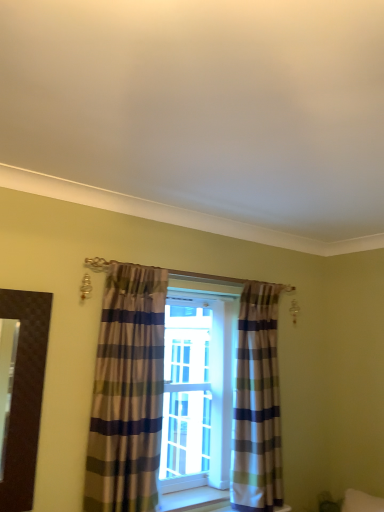
Describe the element at coordinates (257, 403) in the screenshot. I see `striped fabric curtain at center, the 1th curtain viewed from the right` at that location.

What are the coordinates of `striped fabric curtain at center, which appears as the second curtain when viewed from the left` in the screenshot? It's located at (257, 403).

The image size is (384, 512). What are the coordinates of `striped fabric curtain at center, the second curtain in the back-to-front sequence` in the screenshot? It's located at (127, 392).

The image size is (384, 512). Describe the element at coordinates (127, 392) in the screenshot. I see `striped fabric curtain at center, marked as the 2th curtain in a right-to-left arrangement` at that location.

I want to click on striped fabric curtain at center, the 2th curtain viewed from the front, so click(257, 403).

Can you confirm if striped fabric curtain at center, which appears as the second curtain when viewed from the left, is positioned to the left of striped fabric curtain at center, arranged as the first curtain when viewed from the left?

Incorrect, striped fabric curtain at center, which appears as the second curtain when viewed from the left, is not on the left side of striped fabric curtain at center, arranged as the first curtain when viewed from the left.

In the image, is striped fabric curtain at center, which appears as the second curtain when viewed from the left, positioned in front of or behind striped fabric curtain at center, the second curtain in the back-to-front sequence?

striped fabric curtain at center, which appears as the second curtain when viewed from the left, is behind striped fabric curtain at center, the second curtain in the back-to-front sequence.

Which is behind, point (260, 287) or point (157, 411)?

Point (260, 287)

From the image's perspective, is striped fabric curtain at center, which appears as the second curtain when viewed from the left, located beneath striped fabric curtain at center, marked as the 2th curtain in a right-to-left arrangement?

Indeed, from the image's perspective, striped fabric curtain at center, which appears as the second curtain when viewed from the left, is shown beneath striped fabric curtain at center, marked as the 2th curtain in a right-to-left arrangement.

From a real-world perspective, between striped fabric curtain at center, acting as the 1th curtain starting from the back, and striped fabric curtain at center, which is the 1th curtain from front to back, who is vertically higher?

striped fabric curtain at center, which is the 1th curtain from front to back, is physically above.

Between striped fabric curtain at center, which appears as the second curtain when viewed from the left, and striped fabric curtain at center, arranged as the first curtain when viewed from the left, which one has larger width?

Wider between the two is striped fabric curtain at center, which appears as the second curtain when viewed from the left.

Is striped fabric curtain at center, the 1th curtain viewed from the right, taller than striped fabric curtain at center, which is the 1th curtain from front to back?

Yes.

Which of these two, striped fabric curtain at center, which appears as the second curtain when viewed from the left, or striped fabric curtain at center, which is the 1th curtain from front to back, is bigger?

Bigger between the two is striped fabric curtain at center, which appears as the second curtain when viewed from the left.

Can striped fabric curtain at center, which is the 1th curtain from front to back, be found inside striped fabric curtain at center, the 1th curtain viewed from the right?

No, striped fabric curtain at center, which is the 1th curtain from front to back, is not a part of striped fabric curtain at center, the 1th curtain viewed from the right.

Is there a large distance between striped fabric curtain at center, the 2th curtain viewed from the front, and striped fabric curtain at center, arranged as the first curtain when viewed from the left?

They are positioned close to each other.

Is striped fabric curtain at center, the 2th curtain viewed from the front, turned away from striped fabric curtain at center, marked as the 2th curtain in a right-to-left arrangement?

No, striped fabric curtain at center, marked as the 2th curtain in a right-to-left arrangement, is not at the back of striped fabric curtain at center, the 2th curtain viewed from the front.

You are a GUI agent. You are given a task and a screenshot of the screen. Output one action in this format:
    pyautogui.click(x=<x>, y=<y>)
    Task: Click on the curtain on the right of striped fabric curtain at center, the second curtain in the back-to-front sequence
    
    Given the screenshot: What is the action you would take?
    pyautogui.click(x=257, y=403)

Which object is positioned more to the right, striped fabric curtain at center, which is the 1th curtain from front to back, or striped fabric curtain at center, which appears as the second curtain when viewed from the left?

striped fabric curtain at center, which appears as the second curtain when viewed from the left.

Is striped fabric curtain at center, the second curtain in the back-to-front sequence, in front of striped fabric curtain at center, which appears as the second curtain when viewed from the left?

Yes, it is.

Does point (107, 486) appear closer or farther from the camera than point (240, 366)?

Point (107, 486) appears to be closer to the viewer than point (240, 366).

From the image's perspective, is striped fabric curtain at center, the second curtain in the back-to-front sequence, under striped fabric curtain at center, which appears as the second curtain when viewed from the left?

Incorrect, from the image's perspective, striped fabric curtain at center, the second curtain in the back-to-front sequence, is higher than striped fabric curtain at center, which appears as the second curtain when viewed from the left.

From a real-world perspective, is striped fabric curtain at center, arranged as the first curtain when viewed from the left, physically located above or below striped fabric curtain at center, acting as the 1th curtain starting from the back?

Clearly, from a real-world perspective, striped fabric curtain at center, arranged as the first curtain when viewed from the left, is above striped fabric curtain at center, acting as the 1th curtain starting from the back.

In terms of width, does striped fabric curtain at center, which is the 1th curtain from front to back, look wider or thinner when compared to striped fabric curtain at center, the 2th curtain viewed from the front?

Considering their sizes, striped fabric curtain at center, which is the 1th curtain from front to back, looks slimmer than striped fabric curtain at center, the 2th curtain viewed from the front.

Considering the relative sizes of striped fabric curtain at center, marked as the 2th curtain in a right-to-left arrangement, and striped fabric curtain at center, the 2th curtain viewed from the front, in the image provided, is striped fabric curtain at center, marked as the 2th curtain in a right-to-left arrangement, taller than striped fabric curtain at center, the 2th curtain viewed from the front,?

Incorrect, the height of striped fabric curtain at center, marked as the 2th curtain in a right-to-left arrangement, is not larger of that of striped fabric curtain at center, the 2th curtain viewed from the front.

Is striped fabric curtain at center, the second curtain in the back-to-front sequence, bigger than striped fabric curtain at center, the 1th curtain viewed from the right?

Actually, striped fabric curtain at center, the second curtain in the back-to-front sequence, might be smaller than striped fabric curtain at center, the 1th curtain viewed from the right.

Choose the correct answer: Is striped fabric curtain at center, the second curtain in the back-to-front sequence, inside striped fabric curtain at center, acting as the 1th curtain starting from the back, or outside it?

striped fabric curtain at center, the second curtain in the back-to-front sequence, exists outside the volume of striped fabric curtain at center, acting as the 1th curtain starting from the back.

Looking at this image, is striped fabric curtain at center, the second curtain in the back-to-front sequence, next to striped fabric curtain at center, which appears as the second curtain when viewed from the left?

striped fabric curtain at center, the second curtain in the back-to-front sequence, is not next to striped fabric curtain at center, which appears as the second curtain when viewed from the left, and they're not touching.

Is striped fabric curtain at center, the second curtain in the back-to-front sequence, turned away from striped fabric curtain at center, the 1th curtain viewed from the right?

No, striped fabric curtain at center, the 1th curtain viewed from the right, is not at the back of striped fabric curtain at center, the second curtain in the back-to-front sequence.

How different are the orientations of striped fabric curtain at center, arranged as the first curtain when viewed from the left, and striped fabric curtain at center, the 2th curtain viewed from the front, in degrees?

There is a 0.708-degree angle between the facing directions of striped fabric curtain at center, arranged as the first curtain when viewed from the left, and striped fabric curtain at center, the 2th curtain viewed from the front.

Measure the distance between striped fabric curtain at center, marked as the 2th curtain in a right-to-left arrangement, and striped fabric curtain at center, which appears as the second curtain when viewed from the left.

striped fabric curtain at center, marked as the 2th curtain in a right-to-left arrangement, is 27.80 inches away from striped fabric curtain at center, which appears as the second curtain when viewed from the left.

Locate an element on the screen. This screenshot has height=512, width=384. curtain above the striped fabric curtain at center, acting as the 1th curtain starting from the back (from the image's perspective) is located at coordinates (127, 392).

Identify the location of curtain behind the striped fabric curtain at center, which is the 1th curtain from front to back. (257, 403).

The image size is (384, 512). I want to click on curtain lying above the striped fabric curtain at center, the 2th curtain viewed from the front (from the image's perspective), so click(127, 392).